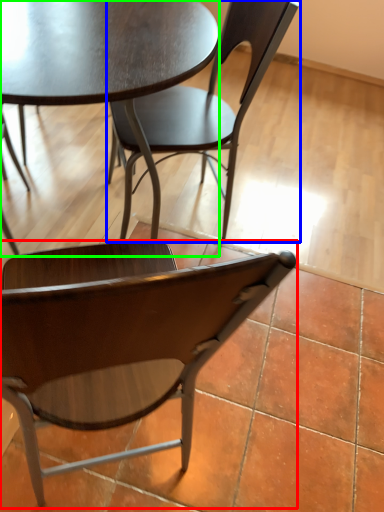
Question: Which is nearer to the chair (highlighted by a red box)? chair (highlighted by a blue box) or coffee table (highlighted by a green box).

Choices:
 (A) chair
 (B) coffee table

Answer: (B)